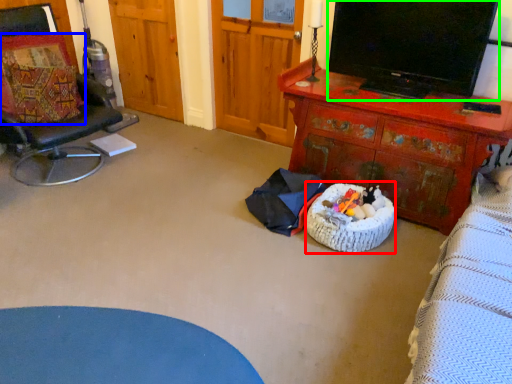
Question: Which object is positioned farthest from infant bed (highlighted by a red box)? Select from pillow (highlighted by a blue box) and television (highlighted by a green box).

Choices:
 (A) pillow
 (B) television

Answer: (A)